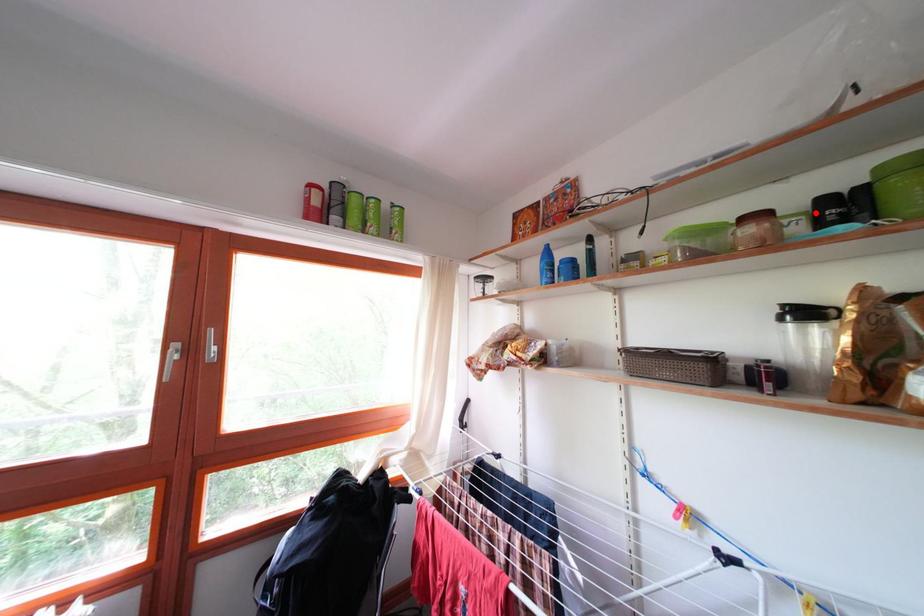
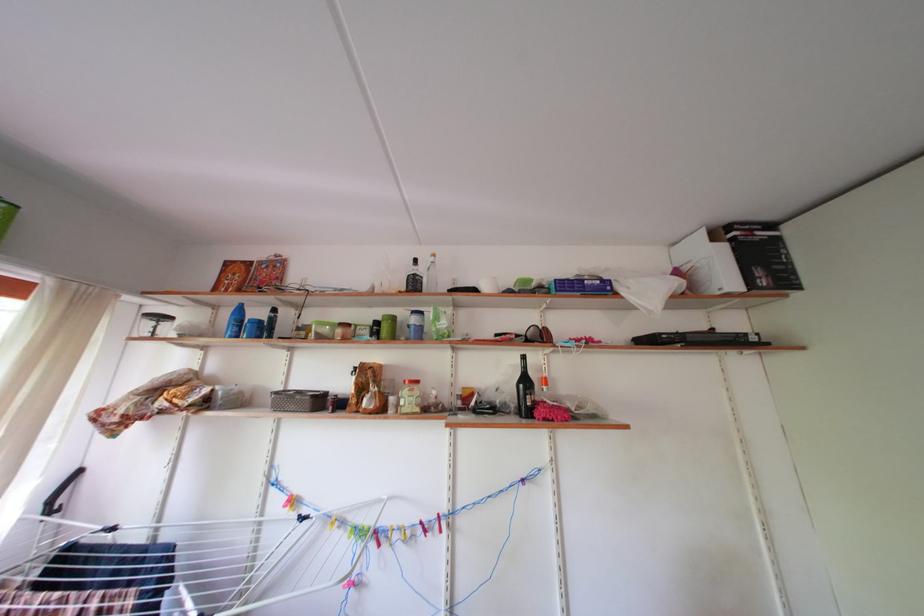
In the second image, find the point that corresponds to the highlighted location in the first image.

(380, 330)